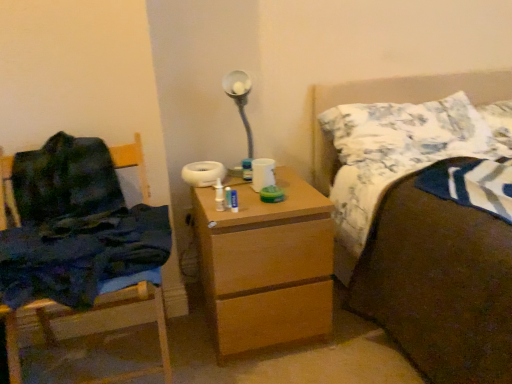
Where is `white cotton pillow at upper right, the first pillow in the right-to-left sequence`? The height and width of the screenshot is (384, 512). white cotton pillow at upper right, the first pillow in the right-to-left sequence is located at coordinates (499, 121).

How much space does white textured pillow at upper right, which appears as the 1th pillow when viewed from the left, occupy horizontally?

The width of white textured pillow at upper right, which appears as the 1th pillow when viewed from the left, is 16.03 inches.

Describe the element at coordinates (81, 255) in the screenshot. The width and height of the screenshot is (512, 384). I see `dark blue fabric at left` at that location.

Image resolution: width=512 pixels, height=384 pixels. Find the location of `brown fabric bed at upper right`. brown fabric bed at upper right is located at coordinates (436, 285).

Identify the location of white cotton pillow at upper right, which is the second pillow from left to right. (499, 121).

Is white cotton pillow at upper right, the first pillow in the right-to-left sequence, further to the viewer compared to white textured pillow at upper right, which appears as the 1th pillow when viewed from the left?

Yes, white cotton pillow at upper right, the first pillow in the right-to-left sequence, is further from the camera.

Considering the relative sizes of white cotton pillow at upper right, the first pillow in the right-to-left sequence, and white textured pillow at upper right, which appears as the 1th pillow when viewed from the left, in the image provided, is white cotton pillow at upper right, the first pillow in the right-to-left sequence, shorter than white textured pillow at upper right, which appears as the 1th pillow when viewed from the left,?

Indeed, white cotton pillow at upper right, the first pillow in the right-to-left sequence, has a lesser height compared to white textured pillow at upper right, which appears as the 1th pillow when viewed from the left.

How different are the orientations of white cotton pillow at upper right, the first pillow in the right-to-left sequence, and white textured pillow at upper right, which ranks as the second pillow in right-to-left order, in degrees?

The facing directions of white cotton pillow at upper right, the first pillow in the right-to-left sequence, and white textured pillow at upper right, which ranks as the second pillow in right-to-left order, are 2.42 degrees apart.

Is point (439, 116) positioned behind point (371, 259)?

Yes, point (439, 116) is farther from viewer.

Is the depth of white textured pillow at upper right, which ranks as the second pillow in right-to-left order, less than that of brown fabric bed at upper right?

No.

Is white textured pillow at upper right, which appears as the 1th pillow when viewed from the left, facing away from brown fabric bed at upper right?

Yes, brown fabric bed at upper right is at the back of white textured pillow at upper right, which appears as the 1th pillow when viewed from the left.

Is white textured pillow at upper right, which appears as the 1th pillow when viewed from the left, not near brown fabric bed at upper right?

No, white textured pillow at upper right, which appears as the 1th pillow when viewed from the left, is not far away from brown fabric bed at upper right.

In the image, is wooden chest of drawers at center on the left side or the right side of white textured pillow at upper right, which ranks as the second pillow in right-to-left order?

Based on their positions, wooden chest of drawers at center is located to the left of white textured pillow at upper right, which ranks as the second pillow in right-to-left order.

At what (x,y) coordinates should I click in order to perform the action: click on the chest of drawers that appears below the white textured pillow at upper right, which appears as the 1th pillow when viewed from the left (from a real-world perspective). Please return your answer as a coordinate pair (x, y). The image size is (512, 384). Looking at the image, I should click on (266, 266).

Is wooden chest of drawers at center inside the boundaries of white textured pillow at upper right, which ranks as the second pillow in right-to-left order, or outside?

wooden chest of drawers at center cannot be found inside white textured pillow at upper right, which ranks as the second pillow in right-to-left order.

Is point (230, 229) positioned after point (508, 132)?

No.

Is wooden chest of drawers at center next to white cotton pillow at upper right, which is the second pillow from left to right, and touching it?

There is a gap between wooden chest of drawers at center and white cotton pillow at upper right, which is the second pillow from left to right.

Who is shorter, wooden chest of drawers at center or white cotton pillow at upper right, which is the second pillow from left to right?

Standing shorter between the two is white cotton pillow at upper right, which is the second pillow from left to right.

From the image's perspective, is wooden chest of drawers at center on top of white cotton pillow at upper right, which is the second pillow from left to right?

No, from the image's perspective, wooden chest of drawers at center is not above white cotton pillow at upper right, which is the second pillow from left to right.

Do you think brown fabric bed at upper right is within wooden chest of drawers at center, or outside of it?

brown fabric bed at upper right is outside wooden chest of drawers at center.

Is brown fabric bed at upper right placed right next to wooden chest of drawers at center?

No, brown fabric bed at upper right is not touching wooden chest of drawers at center.

Between brown fabric bed at upper right and wooden chest of drawers at center, which one is positioned in front?

brown fabric bed at upper right is closer to the camera.

Between brown fabric bed at upper right and wooden chest of drawers at center, which one has less height?

wooden chest of drawers at center.

Is dark blue fabric at left positioned far away from white textured pillow at upper right, which appears as the 1th pillow when viewed from the left?

Absolutely, dark blue fabric at left is distant from white textured pillow at upper right, which appears as the 1th pillow when viewed from the left.

Could you measure the distance between dark blue fabric at left and white textured pillow at upper right, which ranks as the second pillow in right-to-left order?

3.44 feet.

Would you say dark blue fabric at left contains white textured pillow at upper right, which appears as the 1th pillow when viewed from the left?

Actually, white textured pillow at upper right, which appears as the 1th pillow when viewed from the left, is outside dark blue fabric at left.

Is white textured pillow at upper right, which ranks as the second pillow in right-to-left order, in contact with wooden chair at left?

No, white textured pillow at upper right, which ranks as the second pillow in right-to-left order, is not making contact with wooden chair at left.

Considering the sizes of white textured pillow at upper right, which ranks as the second pillow in right-to-left order, and wooden chair at left in the image, is white textured pillow at upper right, which ranks as the second pillow in right-to-left order, wider or thinner than wooden chair at left?

Clearly, white textured pillow at upper right, which ranks as the second pillow in right-to-left order, has less width compared to wooden chair at left.

The height and width of the screenshot is (384, 512). What are the coordinates of `chair that appears in front of the white textured pillow at upper right, which appears as the 1th pillow when viewed from the left` in the screenshot? It's located at (73, 231).

Is white textured pillow at upper right, which ranks as the second pillow in right-to-left order, positioned behind wooden chair at left?

Yes, white textured pillow at upper right, which ranks as the second pillow in right-to-left order, is behind wooden chair at left.

Find the location of `pillow that appears behind the white textured pillow at upper right, which appears as the 1th pillow when viewed from the left`. pillow that appears behind the white textured pillow at upper right, which appears as the 1th pillow when viewed from the left is located at coordinates (499, 121).

At what (x,y) coordinates should I click in order to perform the action: click on pillow that is the 2nd one above the brown fabric bed at upper right (from a real-world perspective). Please return your answer as a coordinate pair (x, y). The width and height of the screenshot is (512, 384). Looking at the image, I should click on (417, 129).

Looking at this image, estimate the real-world distances between objects in this image. Which object is closer to white textured pillow at upper right, which appears as the 1th pillow when viewed from the left, wooden chest of drawers at center or dark blue fabric at left?

Among the two, wooden chest of drawers at center is located nearer to white textured pillow at upper right, which appears as the 1th pillow when viewed from the left.

Considering their positions, is white textured pillow at upper right, which appears as the 1th pillow when viewed from the left, positioned closer to brown fabric bed at upper right than dark blue fabric at left?

white textured pillow at upper right, which appears as the 1th pillow when viewed from the left, is closer to brown fabric bed at upper right.

Which object lies nearer to the anchor point wooden chair at left, brown fabric bed at upper right or dark blue fabric at left?

The object closer to wooden chair at left is dark blue fabric at left.

From the image, which object appears to be nearer to brown fabric bed at upper right, wooden chest of drawers at center or wooden chair at left?

wooden chest of drawers at center lies closer to brown fabric bed at upper right than the other object.

Consider the image. Which object lies further to the anchor point white cotton pillow at upper right, the first pillow in the right-to-left sequence, white textured pillow at upper right, which appears as the 1th pillow when viewed from the left, or wooden chest of drawers at center?

wooden chest of drawers at center.

From the image, which object appears to be nearer to brown fabric bed at upper right, white cotton pillow at upper right, the first pillow in the right-to-left sequence, or white textured pillow at upper right, which ranks as the second pillow in right-to-left order?

white textured pillow at upper right, which ranks as the second pillow in right-to-left order, is closer to brown fabric bed at upper right.

Consider the image. When comparing their distances from brown fabric bed at upper right, does white textured pillow at upper right, which ranks as the second pillow in right-to-left order, or wooden chair at left seem closer?

Based on the image, white textured pillow at upper right, which ranks as the second pillow in right-to-left order, appears to be nearer to brown fabric bed at upper right.

When comparing their distances from wooden chair at left, does dark blue fabric at left or white cotton pillow at upper right, the first pillow in the right-to-left sequence, seem closer?

dark blue fabric at left lies closer to wooden chair at left than the other object.

Where is `chest of drawers between wooden chair at left and brown fabric bed at upper right from left to right`? The height and width of the screenshot is (384, 512). chest of drawers between wooden chair at left and brown fabric bed at upper right from left to right is located at coordinates (266, 266).

You are a GUI agent. You are given a task and a screenshot of the screen. Output one action in this format:
    pyautogui.click(x=<x>, y=<y>)
    Task: Click on the pillow situated between wooden chair at left and brown fabric bed at upper right from left to right
    
    Given the screenshot: What is the action you would take?
    pyautogui.click(x=417, y=129)

At what (x,y) coordinates should I click in order to perform the action: click on blanket situated between wooden chair at left and brown fabric bed at upper right from left to right. Please return your answer as a coordinate pair (x, y). The image size is (512, 384). Looking at the image, I should click on (81, 255).

The width and height of the screenshot is (512, 384). What are the coordinates of `bed between wooden chest of drawers at center and white cotton pillow at upper right, which is the second pillow from left to right` in the screenshot? It's located at (436, 285).